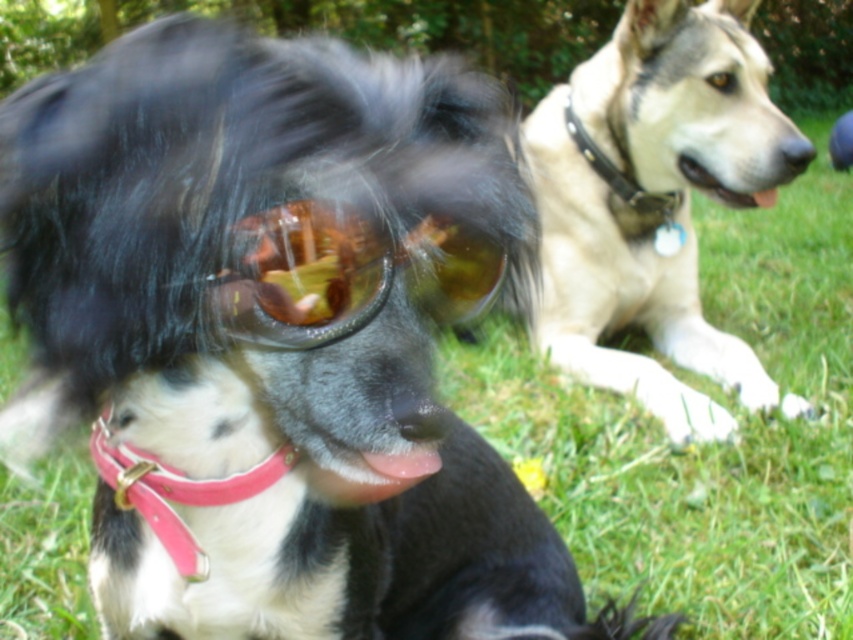
Which is more to the left, shiny plastic goggles at center or pink leather collar at lower left?

From the viewer's perspective, pink leather collar at lower left appears more on the left side.

Can you confirm if shiny plastic goggles at center is positioned to the left of pink leather collar at lower left?

In fact, shiny plastic goggles at center is to the right of pink leather collar at lower left.

This screenshot has width=853, height=640. I want to click on shiny plastic goggles at center, so click(x=345, y=273).

Who is more distant from viewer, (190, 490) or (578, 132)?

The point (578, 132) is more distant.

What do you see at coordinates (173, 490) in the screenshot? I see `pink leather collar at lower left` at bounding box center [173, 490].

The width and height of the screenshot is (853, 640). In order to click on pink leather collar at lower left in this screenshot , I will do `click(173, 490)`.

At what (x,y) coordinates should I click in order to perform the action: click on light brown fur at upper right. Please return your answer as a coordinate pair (x, y). Looking at the image, I should click on (654, 202).

Who is higher up, light brown fur at upper right or shiny plastic goggles at center?

light brown fur at upper right is higher up.

At what (x,y) coordinates should I click in order to perform the action: click on light brown fur at upper right. Please return your answer as a coordinate pair (x, y). This screenshot has height=640, width=853. Looking at the image, I should click on (654, 202).